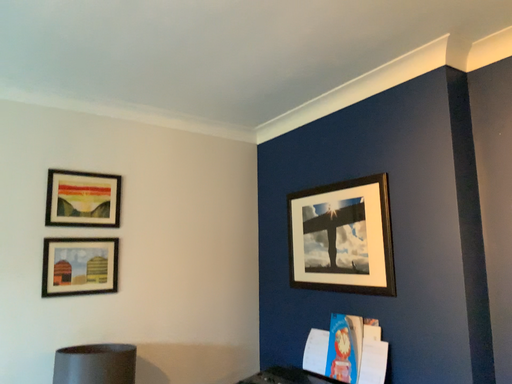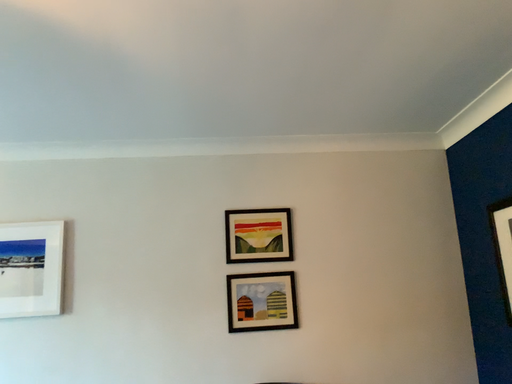
Question: How did the camera likely rotate when shooting the video?

Choices:
 (A) rotated left
 (B) rotated right

Answer: (A)